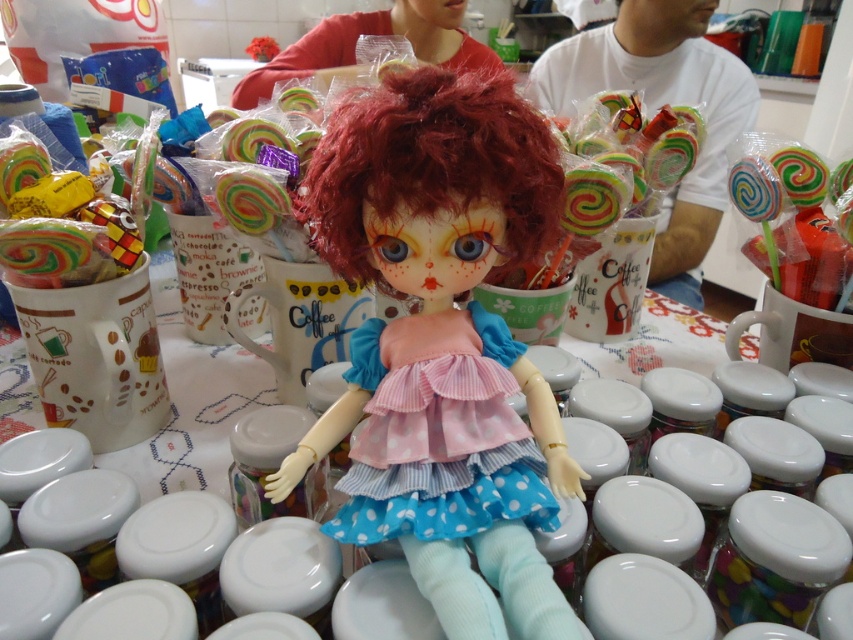
Does point (383, 412) come farther from viewer compared to point (780, 164)?

No, (383, 412) is closer to viewer.

Does pink fabric dress at center have a smaller size compared to multicolored spiral lollipop at center?

Incorrect, pink fabric dress at center is not smaller in size than multicolored spiral lollipop at center.

Image resolution: width=853 pixels, height=640 pixels. In order to click on pink fabric dress at center in this screenshot , I will do `click(444, 497)`.

Can you confirm if satin red wig at center is positioned to the left of pink fabric dress at center?

Indeed, satin red wig at center is positioned on the left side of pink fabric dress at center.

Who is more forward, (550,163) or (363,532)?

Point (363,532) is more forward.

Image resolution: width=853 pixels, height=640 pixels. Describe the element at coordinates (432, 164) in the screenshot. I see `satin red wig at center` at that location.

Identify the location of satin red wig at center. This screenshot has height=640, width=853. (432, 164).

Is point (804, 188) less distant than point (254, 212)?

That is False.

This screenshot has height=640, width=853. Describe the element at coordinates (788, 218) in the screenshot. I see `multicolored lollipop at upper right` at that location.

This screenshot has height=640, width=853. Identify the location of multicolored lollipop at upper right. (788, 218).